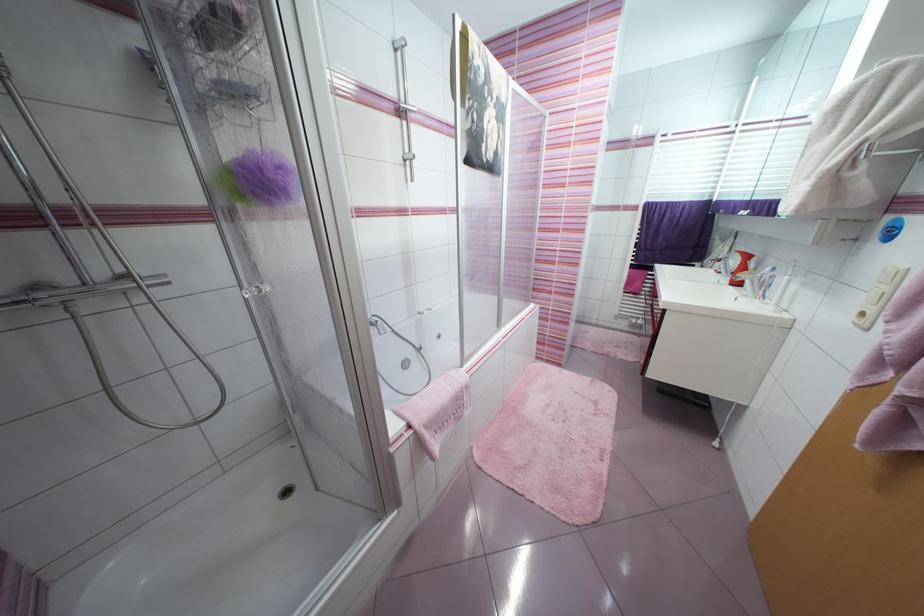
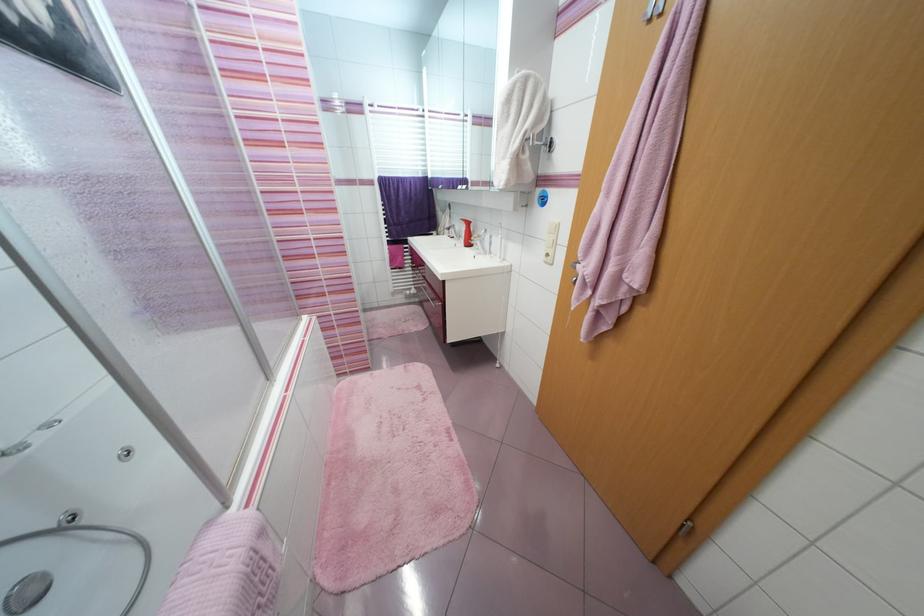
In the second image, find the point that corresponds to the point at 666,308 in the first image.

(445, 281)